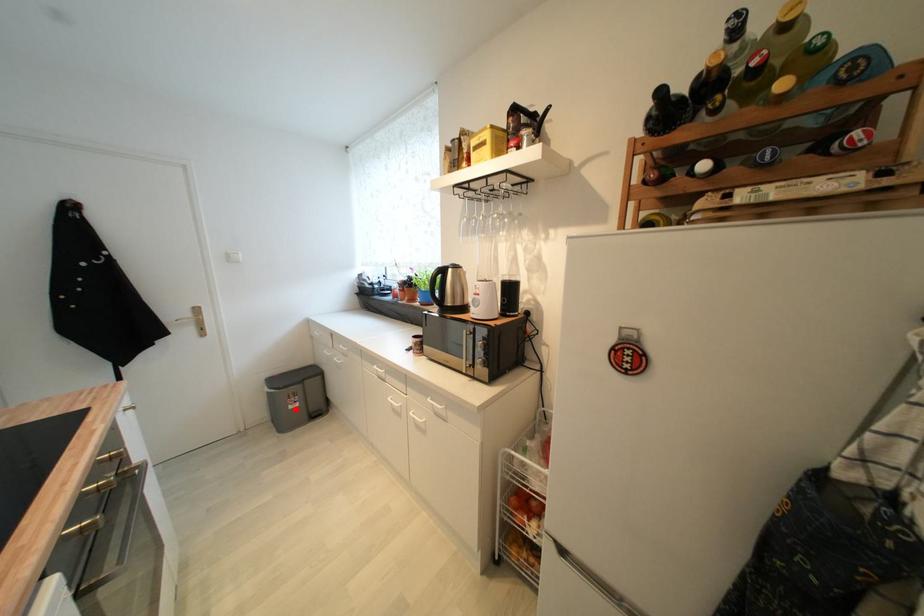
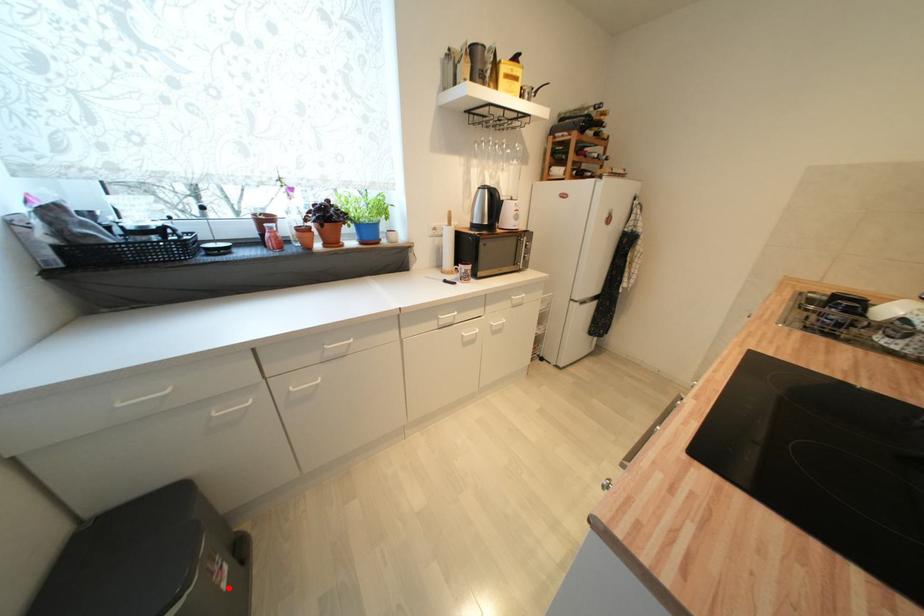
I am providing you with two images of the same scene from different viewpoints. A red point is marked on the first image and another point is marked on the second image. Do the highlighted points in image1 and image2 indicate the same real-world spot?

Yes